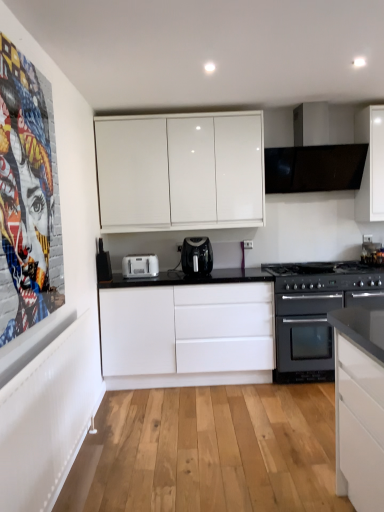
Question: From a real-world perspective, is white plastic toaster at center under white matte cabinet at center, which appears as the 2th cabinetry when viewed from the top?

Choices:
 (A) yes
 (B) no

Answer: (B)

Question: From the image's perspective, is white plastic toaster at center on white matte cabinet at center, the 1th cabinetry ordered from the bottom?

Choices:
 (A) no
 (B) yes

Answer: (B)

Question: Can we say white plastic toaster at center lies outside white matte cabinet at center, which appears as the 2th cabinetry when viewed from the top?

Choices:
 (A) no
 (B) yes

Answer: (B)

Question: Is white plastic toaster at center to the left of white matte cabinet at center, the 1th cabinetry ordered from the bottom, from the viewer's perspective?

Choices:
 (A) yes
 (B) no

Answer: (A)

Question: Does white plastic toaster at center lie behind white matte cabinet at center, which appears as the 2th cabinetry when viewed from the top?

Choices:
 (A) yes
 (B) no

Answer: (A)

Question: Are white plastic toaster at center and white matte cabinet at center, the 1th cabinetry ordered from the bottom, located far from each other?

Choices:
 (A) no
 (B) yes

Answer: (A)

Question: Is black plastic toaster at center, the first appliance in the top-to-bottom sequence, turned away from black matte exhaust hood at upper right?

Choices:
 (A) yes
 (B) no

Answer: (B)

Question: Is black plastic toaster at center, the first appliance in the top-to-bottom sequence, smaller than black matte exhaust hood at upper right?

Choices:
 (A) no
 (B) yes

Answer: (B)

Question: Can you confirm if black plastic toaster at center, the 2th appliance from the right, is positioned to the right of black matte exhaust hood at upper right?

Choices:
 (A) yes
 (B) no

Answer: (B)

Question: Is black matte exhaust hood at upper right located within black plastic toaster at center, which is counted as the second appliance, starting from the bottom?

Choices:
 (A) yes
 (B) no

Answer: (B)

Question: Is black plastic toaster at center, the 2th appliance from the right, to the left of black matte exhaust hood at upper right from the viewer's perspective?

Choices:
 (A) no
 (B) yes

Answer: (B)

Question: Is black plastic toaster at center, the first appliance from the left, positioned beyond the bounds of black matte exhaust hood at upper right?

Choices:
 (A) yes
 (B) no

Answer: (A)

Question: Does white plastic toaster at center have a greater height compared to black plastic air fryer at center?

Choices:
 (A) no
 (B) yes

Answer: (A)